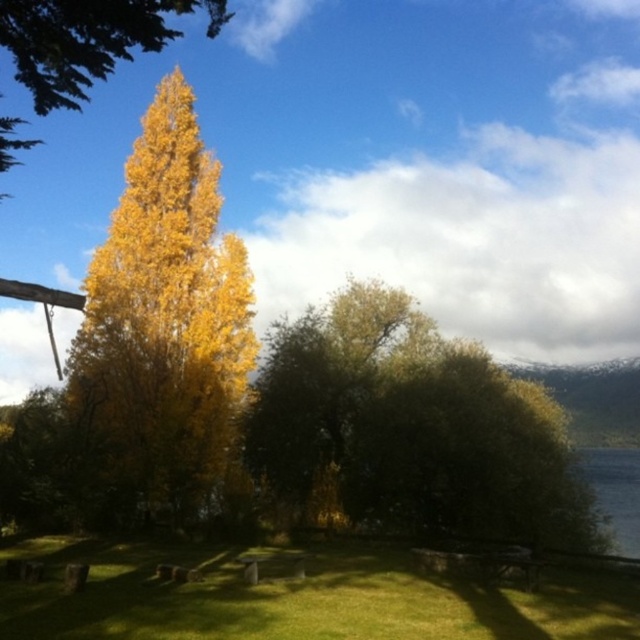
You are standing in the autumnal scene and want to take a photo of both the green leafy tree at center and the golden yellow leaves at center. Which object should you adjust your camera angle to focus on first if you want to capture both in one frame?

The green leafy tree at center is shorter than the golden yellow leaves at center, so you should focus on the shorter green leafy tree at center first to ensure both fit in the frame.

Consider the image. You are standing at the origin point in the scene and want to walk towards the green leafy tree at center. Which direction should you head to reach it?

The green leafy tree at center is located at coordinate point 0.672 on the x axis and 0.644 on the y axis, so you should move towards the northeast direction to reach it.